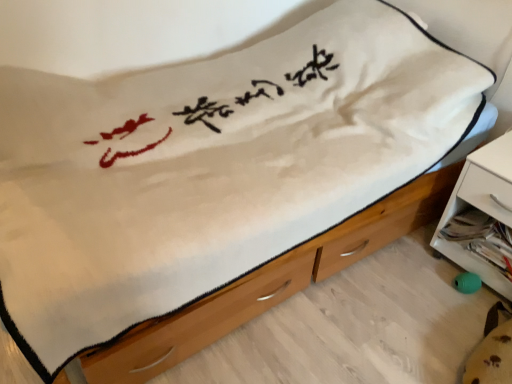
Question: From their relative heights in the image, would you say white plastic nightstand at lower right is taller or shorter than wooden chest of drawers at center?

Choices:
 (A) short
 (B) tall

Answer: (B)

Question: Is white plastic nightstand at lower right wider or thinner than wooden chest of drawers at center?

Choices:
 (A) thin
 (B) wide

Answer: (A)

Question: Relative to wooden chest of drawers at center, is white plastic nightstand at lower right in front or behind?

Choices:
 (A) behind
 (B) front

Answer: (A)

Question: From the image's perspective, is wooden chest of drawers at center positioned above or below white plastic nightstand at lower right?

Choices:
 (A) below
 (B) above

Answer: (A)

Question: Considering the relative positions of wooden chest of drawers at center and white plastic nightstand at lower right in the image provided, is wooden chest of drawers at center to the left or to the right of white plastic nightstand at lower right?

Choices:
 (A) left
 (B) right

Answer: (A)

Question: Is wooden chest of drawers at center wider or thinner than white plastic nightstand at lower right?

Choices:
 (A) wide
 (B) thin

Answer: (A)

Question: Considering their positions, is wooden chest of drawers at center located in front of or behind white plastic nightstand at lower right?

Choices:
 (A) front
 (B) behind

Answer: (A)